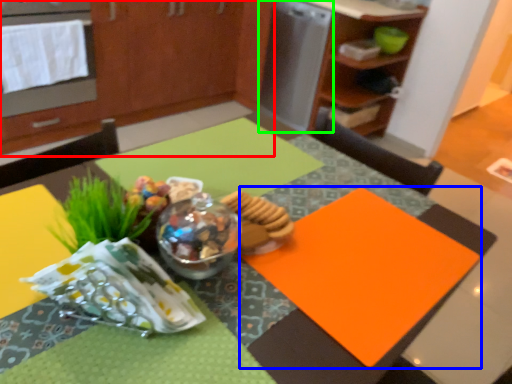
Question: Based on their relative distances, which object is nearer to cabinetry (highlighted by a red box)? Choose from place mat (highlighted by a blue box) and appliance (highlighted by a green box).

Choices:
 (A) place mat
 (B) appliance

Answer: (B)